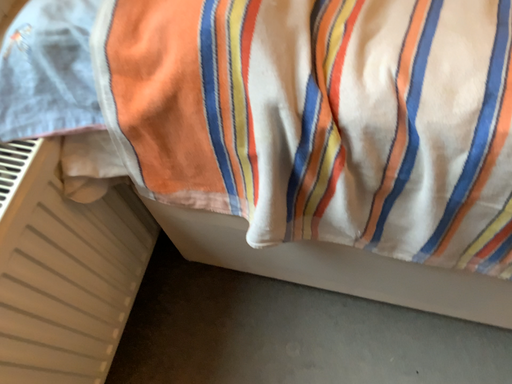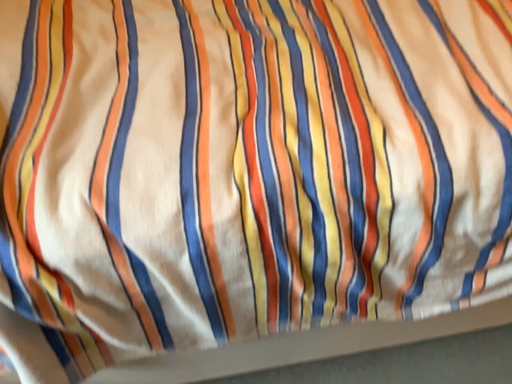
Question: Which way did the camera rotate in the video?

Choices:
 (A) rotated upward
 (B) rotated downward

Answer: (A)